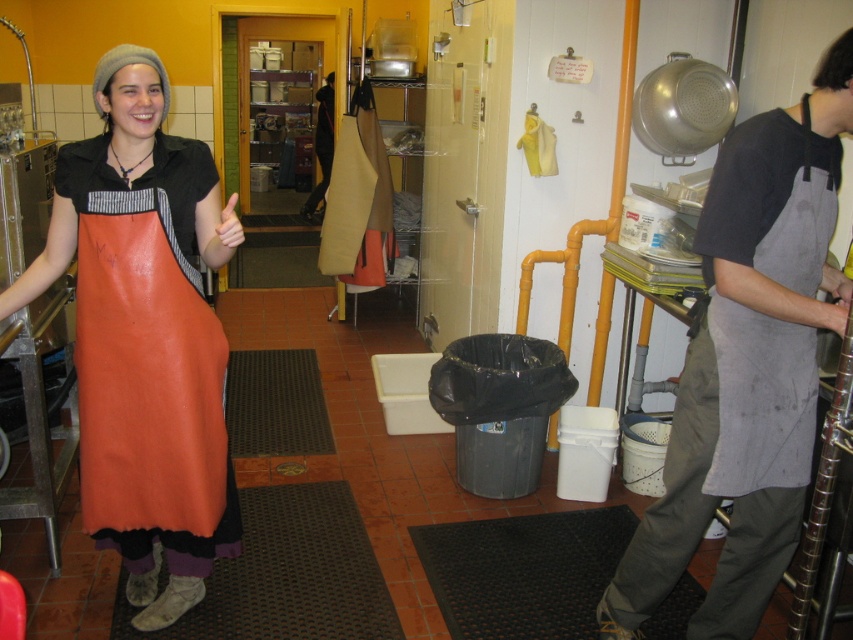
Please look at the scene and find the gray fabric apron at right. What are its coordinates in the image?

The gray fabric apron at right is located at coordinates 0.486 on the x axis and 0.890 on the y axis.

You are a chef trying to decide whether to place your skinny white hand at center on top of the gray fabric apron at right. Based on their sizes, will your hand fit entirely on the apron without hanging off the edges?

The gray fabric apron at right is wider than the skinny white hand at center, so yes, the hand can fit entirely on the apron without any part hanging off the edges.